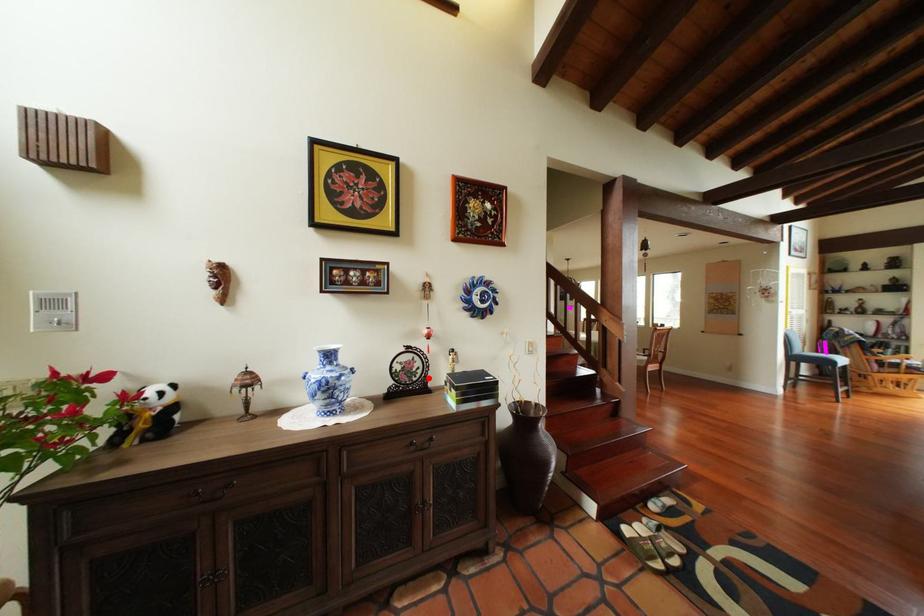
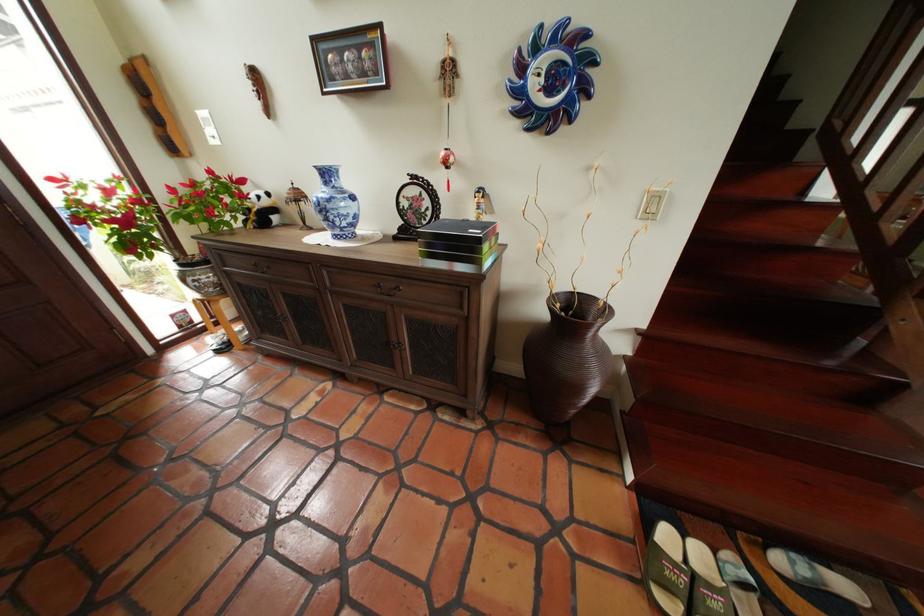
In the second image, find the point that corresponds to the highlighted location in the first image.

(438, 221)